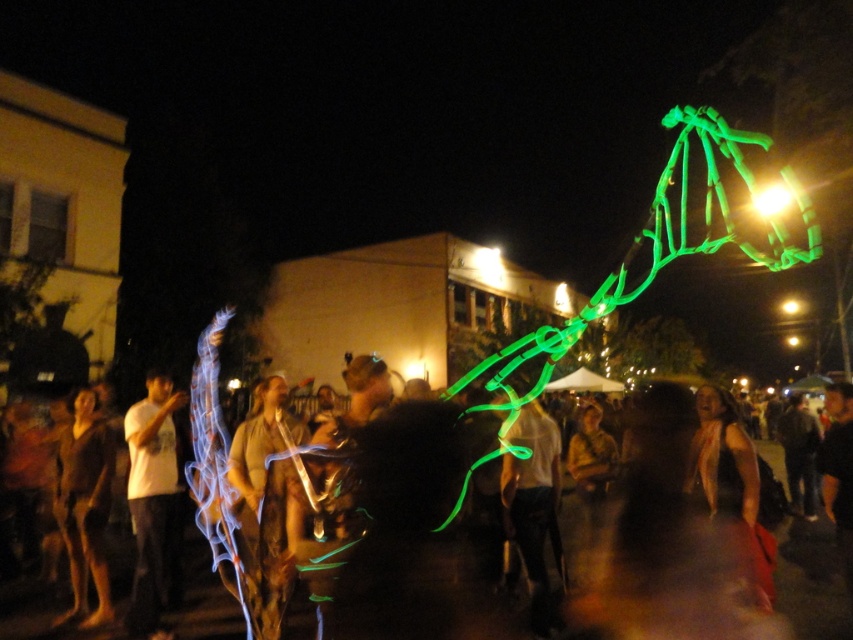
Is white matte t-shirt at left shorter than brown textured fabric at left?

No.

From the picture: Does white matte t-shirt at left come in front of brown textured fabric at left?

Yes, it is in front of brown textured fabric at left.

This screenshot has height=640, width=853. In order to click on white matte t-shirt at left in this screenshot , I will do `click(151, 499)`.

Can you confirm if translucent fabric at center is positioned to the right of white matte t-shirt at left?

Yes, translucent fabric at center is to the right of white matte t-shirt at left.

Is point (573, 554) positioned behind point (144, 561)?

Yes, it is behind point (144, 561).

Where is `translucent fabric at center`? translucent fabric at center is located at coordinates (811, 580).

Who is positioned more to the right, translucent fabric at center or brown textured fabric at left?

From the viewer's perspective, translucent fabric at center appears more on the right side.

Image resolution: width=853 pixels, height=640 pixels. Find the location of `translucent fabric at center`. translucent fabric at center is located at coordinates (811, 580).

At what (x,y) coordinates should I click in order to perform the action: click on translucent fabric at center. Please return your answer as a coordinate pair (x, y). The image size is (853, 640). Looking at the image, I should click on (811, 580).